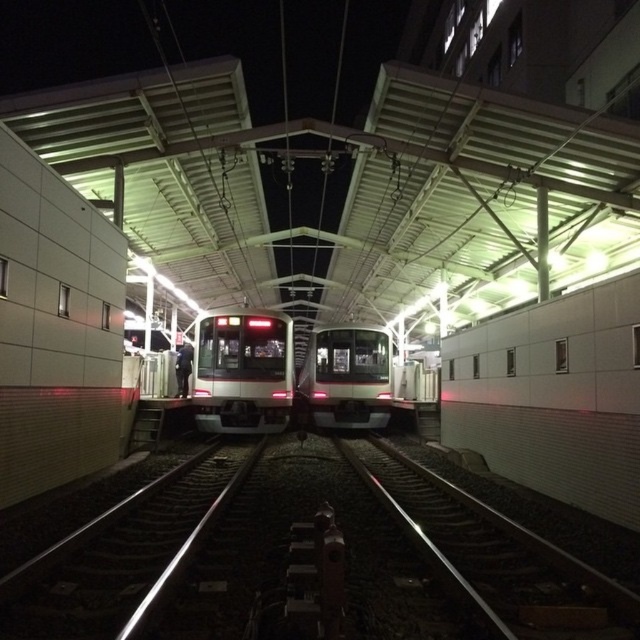
Question: Does matte silver train at center appear on the left side of white glossy train at center?

Choices:
 (A) yes
 (B) no

Answer: (A)

Question: Considering the relative positions of metal/smooth track at center and white glossy train at center in the image provided, where is metal/smooth track at center located with respect to white glossy train at center?

Choices:
 (A) right
 (B) left

Answer: (B)

Question: Which point appears closest to the camera in this image?

Choices:
 (A) (481, 620)
 (B) (243, 422)

Answer: (A)

Question: Among these points, which one is nearest to the camera?

Choices:
 (A) (369, 406)
 (B) (444, 600)
 (C) (244, 358)

Answer: (B)

Question: Does metal/smooth track at center appear under matte silver train at center?

Choices:
 (A) yes
 (B) no

Answer: (A)

Question: Which is nearer to the metal/smooth track at center?

Choices:
 (A) white glossy train at center
 (B) matte silver train at center

Answer: (B)